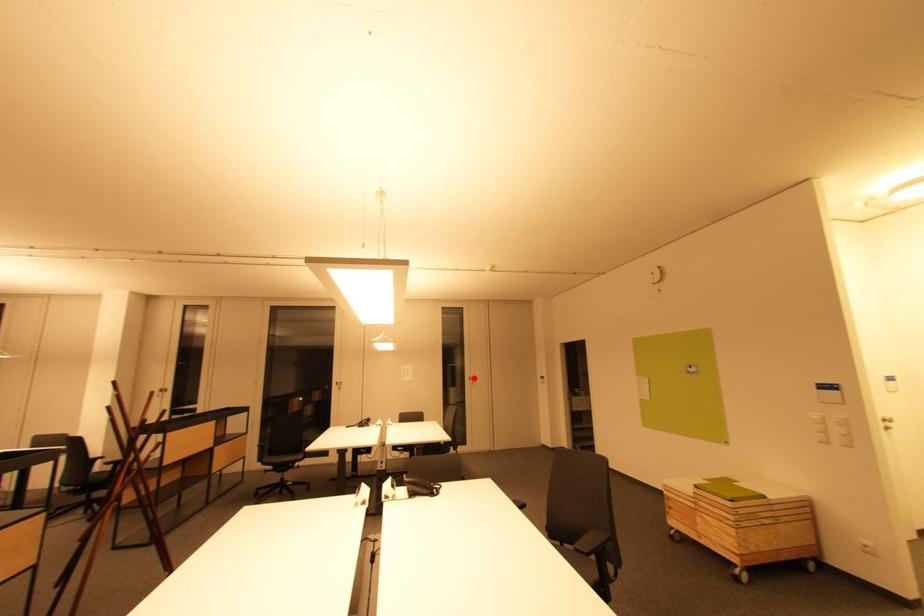
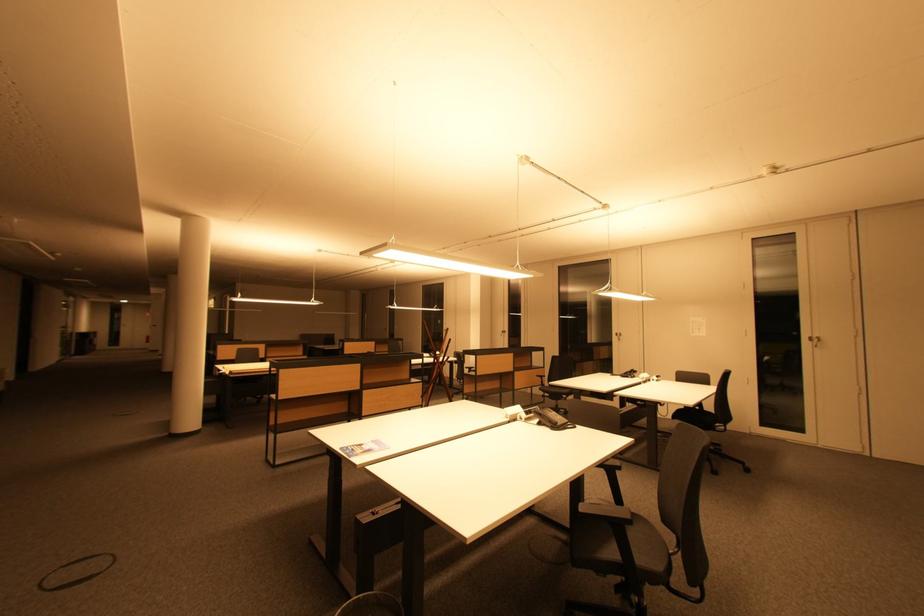
Where in the second image is the point corresponding to the highlighted location from the first image?

(815, 338)